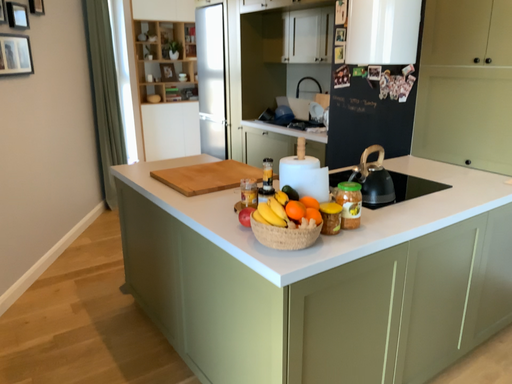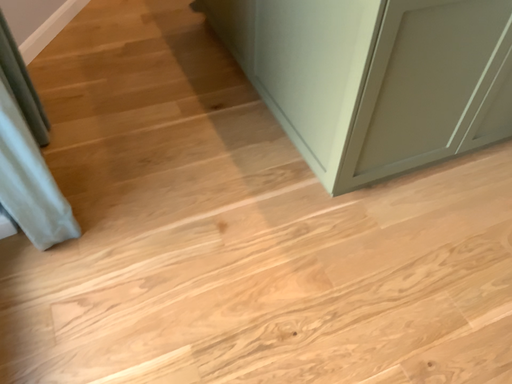
Question: Which way did the camera rotate in the video?

Choices:
 (A) rotated right
 (B) rotated left

Answer: (B)